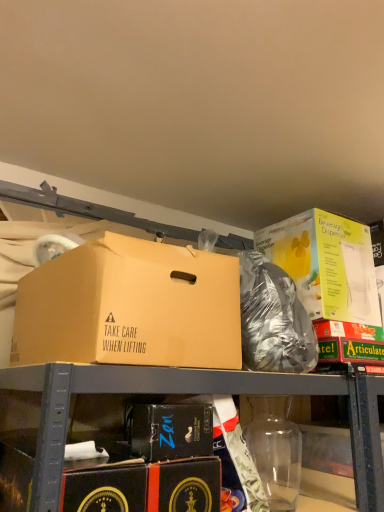
From the picture: Measure the distance between black cardboard box at lower center, placed as the 2th box when sorted from right to left, and camera.

black cardboard box at lower center, placed as the 2th box when sorted from right to left, is 33.78 inches from camera.

The width and height of the screenshot is (384, 512). Identify the location of black cardboard box at lower center, placed as the 2th box when sorted from right to left. (169, 430).

The image size is (384, 512). In order to click on matte cardboard box at upper left, which appears as the 3th box when viewed from the right in this screenshot , I will do [130, 307].

From a real-world perspective, which object stands above the other?

In real-world perspective, matte cardboard box at upper left, which appears as the 3th box when viewed from the right, is above.

Find the location of a particular element. box located below the matte cardboard box at upper left, which appears as the 3th box when viewed from the right (from the image's perspective) is located at coordinates (169, 430).

Is matte cardboard box at upper left, placed as the 1th box when sorted from left to right, positioned far away from black cardboard box at lower center, placed as the 2th box when sorted from right to left?

No.

Between matte cardboard box at upper left, placed as the 1th box when sorted from left to right, and black cardboard box at lower center, placed as the 2th box when sorted from right to left, which one appears on the right side from the viewer's perspective?

Positioned to the right is black cardboard box at lower center, placed as the 2th box when sorted from right to left.

Is point (88, 340) behind point (282, 222)?

No, (88, 340) is in front of (282, 222).

From the image's perspective, is matte cardboard box at upper left, placed as the 1th box when sorted from left to right, positioned above or below yellow cardboard beverage dispenser at upper right, which is the 1th box from right to left?

matte cardboard box at upper left, placed as the 1th box when sorted from left to right, is below yellow cardboard beverage dispenser at upper right, which is the 1th box from right to left.

Which object is closer to the camera taking this photo, matte cardboard box at upper left, which appears as the 3th box when viewed from the right, or yellow cardboard beverage dispenser at upper right, the 3th box from the left?

matte cardboard box at upper left, which appears as the 3th box when viewed from the right, is more forward.

Between matte cardboard box at upper left, which appears as the 3th box when viewed from the right, and yellow cardboard beverage dispenser at upper right, the 3th box from the left, which one has larger size?

Bigger between the two is matte cardboard box at upper left, which appears as the 3th box when viewed from the right.

Which is in front, point (291, 252) or point (176, 335)?

Point (176, 335)

Considering the positions of objects yellow cardboard beverage dispenser at upper right, the 3th box from the left, and matte cardboard box at upper left, placed as the 1th box when sorted from left to right, in the image provided, who is behind, yellow cardboard beverage dispenser at upper right, the 3th box from the left, or matte cardboard box at upper left, placed as the 1th box when sorted from left to right,?

yellow cardboard beverage dispenser at upper right, the 3th box from the left.

Is yellow cardboard beverage dispenser at upper right, the 3th box from the left, inside or outside of matte cardboard box at upper left, placed as the 1th box when sorted from left to right?

yellow cardboard beverage dispenser at upper right, the 3th box from the left, is not inside matte cardboard box at upper left, placed as the 1th box when sorted from left to right, it's outside.

Considering the positions of objects transparent plastic bottle at lower center and yellow cardboard beverage dispenser at upper right, which is the 1th box from right to left, in the image provided, who is more to the left, transparent plastic bottle at lower center or yellow cardboard beverage dispenser at upper right, which is the 1th box from right to left,?

Positioned to the left is transparent plastic bottle at lower center.

Consider the image. Do you think transparent plastic bottle at lower center is within yellow cardboard beverage dispenser at upper right, which is the 1th box from right to left, or outside of it?

transparent plastic bottle at lower center exists outside the volume of yellow cardboard beverage dispenser at upper right, which is the 1th box from right to left.

Can you see transparent plastic bottle at lower center touching yellow cardboard beverage dispenser at upper right, which is the 1th box from right to left?

No, transparent plastic bottle at lower center is not touching yellow cardboard beverage dispenser at upper right, which is the 1th box from right to left.

Considering the sizes of objects transparent plastic bottle at lower center and yellow cardboard beverage dispenser at upper right, the 3th box from the left, in the image provided, who is smaller, transparent plastic bottle at lower center or yellow cardboard beverage dispenser at upper right, the 3th box from the left,?

With smaller size is transparent plastic bottle at lower center.

Is transparent plastic bottle at lower center aimed at black cardboard box at lower center, placed as the 2th box when sorted from right to left?

No, transparent plastic bottle at lower center is not facing towards black cardboard box at lower center, placed as the 2th box when sorted from right to left.

Is point (288, 444) positioned behind point (191, 453)?

That is True.

Can you confirm if transparent plastic bottle at lower center is wider than black cardboard box at lower center, placed as the 2th box when sorted from right to left?

In fact, transparent plastic bottle at lower center might be narrower than black cardboard box at lower center, placed as the 2th box when sorted from right to left.

Would you say transparent plastic bottle at lower center is to the left or to the right of black cardboard box at lower center, placed as the 2th box when sorted from right to left, in the picture?

In the image, transparent plastic bottle at lower center appears on the right side of black cardboard box at lower center, placed as the 2th box when sorted from right to left.

Visually, is black cardboard box at lower center, placed as the 2th box when sorted from right to left, positioned to the left or to the right of transparent plastic bottle at lower center?

From the image, it's evident that black cardboard box at lower center, placed as the 2th box when sorted from right to left, is to the left of transparent plastic bottle at lower center.

In the scene shown: From a real-world perspective, is black cardboard box at lower center, which is counted as the 2th box, starting from the left, above or below transparent plastic bottle at lower center?

From a real-world perspective, black cardboard box at lower center, which is counted as the 2th box, starting from the left, is physically above transparent plastic bottle at lower center.

Which is in front, point (142, 405) or point (284, 467)?

Positioned in front is point (142, 405).

Is black cardboard box at lower center, placed as the 2th box when sorted from right to left, situated inside transparent plastic bottle at lower center or outside?

black cardboard box at lower center, placed as the 2th box when sorted from right to left, is not inside transparent plastic bottle at lower center, it's outside.

Is black cardboard box at lower center, which is counted as the 2th box, starting from the left, wider or thinner than yellow cardboard beverage dispenser at upper right, the 3th box from the left?

Clearly, black cardboard box at lower center, which is counted as the 2th box, starting from the left, has less width compared to yellow cardboard beverage dispenser at upper right, the 3th box from the left.

Which object is further away from the camera taking this photo, black cardboard box at lower center, which is counted as the 2th box, starting from the left, or yellow cardboard beverage dispenser at upper right, the 3th box from the left?

yellow cardboard beverage dispenser at upper right, the 3th box from the left, is more distant.

Considering the relative positions of black cardboard box at lower center, placed as the 2th box when sorted from right to left, and yellow cardboard beverage dispenser at upper right, which is the 1th box from right to left, in the image provided, is black cardboard box at lower center, placed as the 2th box when sorted from right to left, to the right of yellow cardboard beverage dispenser at upper right, which is the 1th box from right to left, from the viewer's perspective?

In fact, black cardboard box at lower center, placed as the 2th box when sorted from right to left, is to the left of yellow cardboard beverage dispenser at upper right, which is the 1th box from right to left.

How much distance is there between black cardboard box at lower center, placed as the 2th box when sorted from right to left, and yellow cardboard beverage dispenser at upper right, which is the 1th box from right to left?

black cardboard box at lower center, placed as the 2th box when sorted from right to left, is 27.54 inches away from yellow cardboard beverage dispenser at upper right, which is the 1th box from right to left.

Where is `box that is in front of the black cardboard box at lower center, placed as the 2th box when sorted from right to left`? box that is in front of the black cardboard box at lower center, placed as the 2th box when sorted from right to left is located at coordinates (130, 307).

You are a GUI agent. You are given a task and a screenshot of the screen. Output one action in this format:
    pyautogui.click(x=<x>, y=<y>)
    Task: Click on the box above the matte cardboard box at upper left, which appears as the 3th box when viewed from the right (from the image's perspective)
    
    Given the screenshot: What is the action you would take?
    pyautogui.click(x=326, y=264)

From the picture: Looking at the image, which one is located closer to transparent plastic bottle at lower center, yellow cardboard beverage dispenser at upper right, which is the 1th box from right to left, or black cardboard box at lower center, which is counted as the 2th box, starting from the left?

The object closer to transparent plastic bottle at lower center is black cardboard box at lower center, which is counted as the 2th box, starting from the left.

From the image, which object appears to be farther from matte cardboard box at upper left, placed as the 1th box when sorted from left to right, black cardboard box at lower center, which is counted as the 2th box, starting from the left, or transparent plastic bottle at lower center?

The object further to matte cardboard box at upper left, placed as the 1th box when sorted from left to right, is transparent plastic bottle at lower center.

When comparing their distances from transparent plastic bottle at lower center, does matte cardboard box at upper left, placed as the 1th box when sorted from left to right, or black cardboard box at lower center, which is counted as the 2th box, starting from the left, seem further?

Among the two, matte cardboard box at upper left, placed as the 1th box when sorted from left to right, is located further to transparent plastic bottle at lower center.

Looking at the image, which one is located closer to yellow cardboard beverage dispenser at upper right, which is the 1th box from right to left, black cardboard box at lower center, placed as the 2th box when sorted from right to left, or transparent plastic bottle at lower center?

transparent plastic bottle at lower center is positioned closer to the anchor yellow cardboard beverage dispenser at upper right, which is the 1th box from right to left.

Considering their positions, is matte cardboard box at upper left, which appears as the 3th box when viewed from the right, positioned closer to yellow cardboard beverage dispenser at upper right, which is the 1th box from right to left, than transparent plastic bottle at lower center?

transparent plastic bottle at lower center lies closer to yellow cardboard beverage dispenser at upper right, which is the 1th box from right to left, than the other object.

From the image, which object appears to be farther from black cardboard box at lower center, which is counted as the 2th box, starting from the left, transparent plastic bottle at lower center or yellow cardboard beverage dispenser at upper right, which is the 1th box from right to left?

Based on the image, yellow cardboard beverage dispenser at upper right, which is the 1th box from right to left, appears to be further to black cardboard box at lower center, which is counted as the 2th box, starting from the left.

Considering their positions, is transparent plastic bottle at lower center positioned further to black cardboard box at lower center, placed as the 2th box when sorted from right to left, than matte cardboard box at upper left, which appears as the 3th box when viewed from the right?

transparent plastic bottle at lower center is positioned further to the anchor black cardboard box at lower center, placed as the 2th box when sorted from right to left.

Looking at the image, which one is located closer to black cardboard box at lower center, placed as the 2th box when sorted from right to left, yellow cardboard beverage dispenser at upper right, which is the 1th box from right to left, or transparent plastic bottle at lower center?

transparent plastic bottle at lower center.

Where is `bottle between black cardboard box at lower center, which is counted as the 2th box, starting from the left, and yellow cardboard beverage dispenser at upper right, the 3th box from the left`? The height and width of the screenshot is (512, 384). bottle between black cardboard box at lower center, which is counted as the 2th box, starting from the left, and yellow cardboard beverage dispenser at upper right, the 3th box from the left is located at coordinates (275, 450).

The height and width of the screenshot is (512, 384). In order to click on bottle between matte cardboard box at upper left, placed as the 1th box when sorted from left to right, and yellow cardboard beverage dispenser at upper right, the 3th box from the left, from left to right in this screenshot , I will do `click(275, 450)`.

Image resolution: width=384 pixels, height=512 pixels. I want to click on box located between matte cardboard box at upper left, placed as the 1th box when sorted from left to right, and yellow cardboard beverage dispenser at upper right, which is the 1th box from right to left, in the left-right direction, so click(169, 430).

Locate an element on the screen. Image resolution: width=384 pixels, height=512 pixels. box between matte cardboard box at upper left, placed as the 1th box when sorted from left to right, and transparent plastic bottle at lower center vertically is located at coordinates (169, 430).